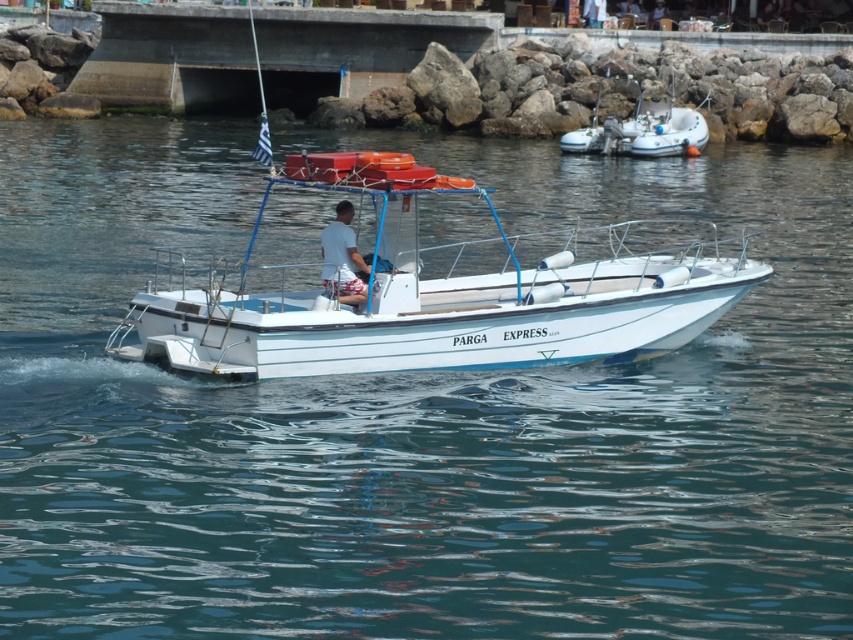
What is the 2D coordinate of the white rubber dinghy at upper right in the image?

The white rubber dinghy at upper right is located at the 2D coordinate point of (642,131).

From the picture: You are a passenger on the Parga Express motorboat and want to move from the front to the back of the boat. Which object will you pass first, the white rubber dinghy at upper right or the white printed shorts at center?

You will pass the white rubber dinghy at upper right first because it is closer to you than the white printed shorts at center.

You are a passenger on the white matte boat at center and need to move to the white printed shorts at center. Can you walk from one end of the boat to the shorts without stepping off the boat?

The white matte boat at center is wider than the white printed shorts at center, so yes, you can walk from one end of the boat to the shorts without stepping off the boat since the boat is wider than the shorts.